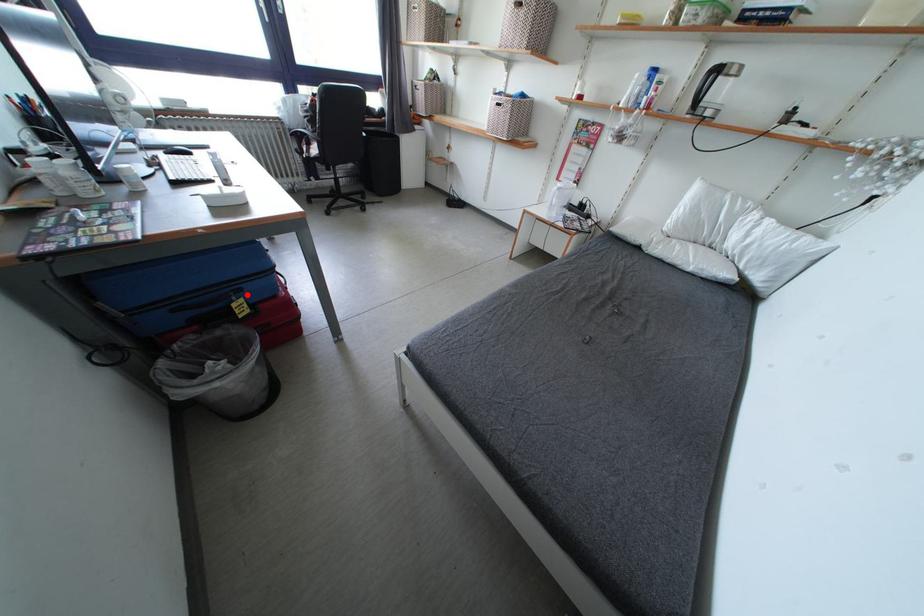
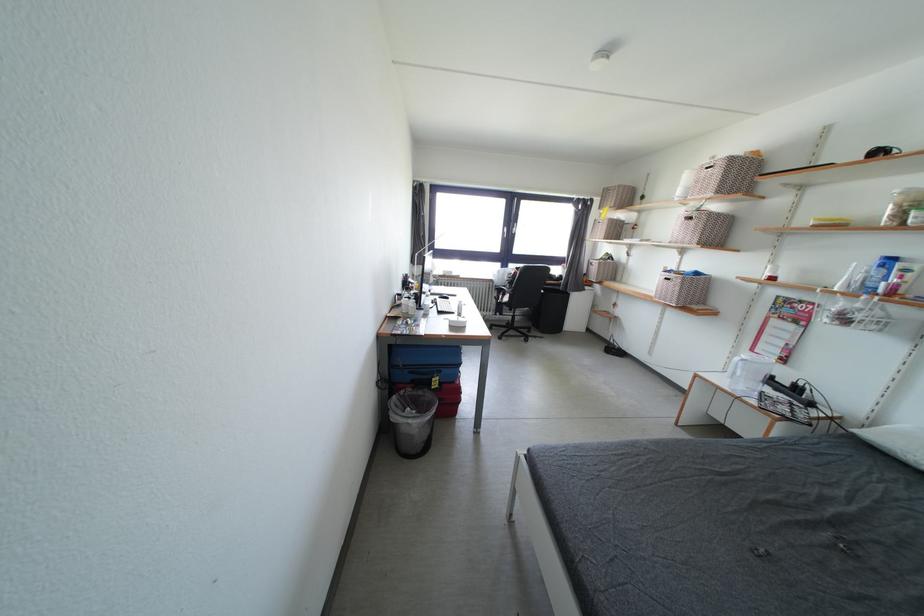
Question: I am providing you with two images of the same scene from different viewpoints. A red point is shown in image1. For the corresponding object point in image2, is it positioned nearer or farther from the camera?

Choices:
 (A) Nearer
 (B) Farther

Answer: (B)